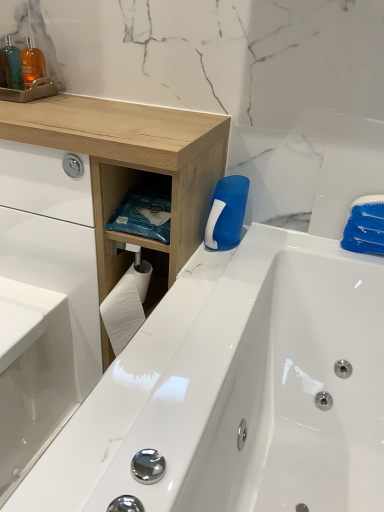
Question: Is blue plastic cleaning brush at upper right aimed at translucent plastic bottle at upper left?

Choices:
 (A) no
 (B) yes

Answer: (A)

Question: Can you confirm if blue plastic cleaning brush at upper right is thinner than translucent plastic bottle at upper left?

Choices:
 (A) yes
 (B) no

Answer: (B)

Question: Considering the relative sizes of blue plastic cleaning brush at upper right and translucent plastic bottle at upper left in the image provided, is blue plastic cleaning brush at upper right smaller than translucent plastic bottle at upper left?

Choices:
 (A) yes
 (B) no

Answer: (B)

Question: Is blue plastic cleaning brush at upper right at the right side of translucent plastic bottle at upper left?

Choices:
 (A) no
 (B) yes

Answer: (B)

Question: Is blue plastic cleaning brush at upper right looking in the opposite direction of translucent plastic bottle at upper left?

Choices:
 (A) yes
 (B) no

Answer: (B)

Question: Is blue plastic cleaning brush at upper right located outside translucent plastic bottle at upper left?

Choices:
 (A) yes
 (B) no

Answer: (A)

Question: Does white glossy sink at lower left have a smaller size compared to blue plastic cleaning brush at upper right?

Choices:
 (A) yes
 (B) no

Answer: (B)

Question: Considering the relative sizes of white glossy sink at lower left and blue plastic cleaning brush at upper right in the image provided, is white glossy sink at lower left taller than blue plastic cleaning brush at upper right?

Choices:
 (A) no
 (B) yes

Answer: (B)

Question: Is the depth of white glossy sink at lower left less than that of blue plastic cleaning brush at upper right?

Choices:
 (A) no
 (B) yes

Answer: (B)

Question: Does white glossy sink at lower left contain blue plastic cleaning brush at upper right?

Choices:
 (A) no
 (B) yes

Answer: (A)

Question: Are white glossy sink at lower left and blue plastic cleaning brush at upper right far apart?

Choices:
 (A) yes
 (B) no

Answer: (B)

Question: Is white glossy sink at lower left further to camera compared to blue plastic cleaning brush at upper right?

Choices:
 (A) no
 (B) yes

Answer: (A)

Question: Is white glossy sink at lower left taller than translucent plastic bottle at upper left?

Choices:
 (A) yes
 (B) no

Answer: (A)